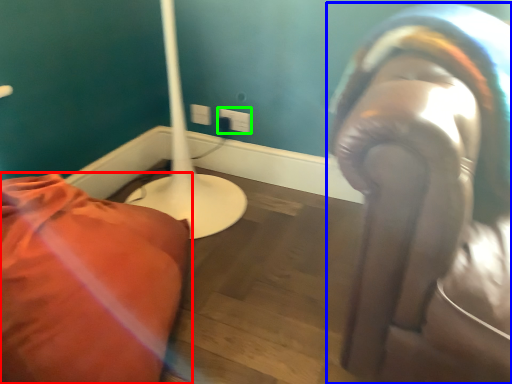
Question: Which object is the farthest from furniture (highlighted by a red box)? Choose among these: person (highlighted by a blue box) or electric outlet (highlighted by a green box).

Choices:
 (A) person
 (B) electric outlet

Answer: (B)